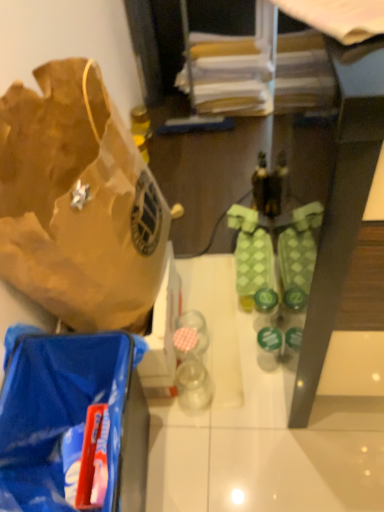
Question: Can you confirm if green matte bottle at center is wider than blue plastic bag at lower left?

Choices:
 (A) yes
 (B) no

Answer: (B)

Question: Could you tell me if green matte bottle at center is turned towards blue plastic bag at lower left?

Choices:
 (A) yes
 (B) no

Answer: (B)

Question: Can you confirm if green matte bottle at center is shorter than blue plastic bag at lower left?

Choices:
 (A) yes
 (B) no

Answer: (A)

Question: From a real-world perspective, is green matte bottle at center positioned over blue plastic bag at lower left based on gravity?

Choices:
 (A) yes
 (B) no

Answer: (B)

Question: From the image's perspective, would you say green matte bottle at center is shown under blue plastic bag at lower left?

Choices:
 (A) no
 (B) yes

Answer: (A)

Question: From a real-world perspective, is green matte bottle at center positioned above or below green textured socks at center?

Choices:
 (A) below
 (B) above

Answer: (B)

Question: Considering the positions of green matte bottle at center and green textured socks at center in the image, is green matte bottle at center taller or shorter than green textured socks at center?

Choices:
 (A) tall
 (B) short

Answer: (B)

Question: From the image's perspective, is green matte bottle at center above or below green textured socks at center?

Choices:
 (A) above
 (B) below

Answer: (B)

Question: Is green matte bottle at center in front of or behind green textured socks at center in the image?

Choices:
 (A) behind
 (B) front

Answer: (B)

Question: Considering the relative positions of blue plastic bag at lower left and brown paper bag at left in the image provided, is blue plastic bag at lower left to the left or to the right of brown paper bag at left?

Choices:
 (A) left
 (B) right

Answer: (B)

Question: Based on their sizes in the image, would you say blue plastic bag at lower left is bigger or smaller than brown paper bag at left?

Choices:
 (A) small
 (B) big

Answer: (A)

Question: Is blue plastic bag at lower left inside or outside of brown paper bag at left?

Choices:
 (A) outside
 (B) inside

Answer: (A)

Question: Relative to brown paper bag at left, is blue plastic bag at lower left in front or behind?

Choices:
 (A) front
 (B) behind

Answer: (B)

Question: In terms of width, does green matte bottle at center look wider or thinner when compared to brown paper bag at left?

Choices:
 (A) wide
 (B) thin

Answer: (B)

Question: Considering the positions of green matte bottle at center and brown paper bag at left in the image, is green matte bottle at center bigger or smaller than brown paper bag at left?

Choices:
 (A) big
 (B) small

Answer: (B)